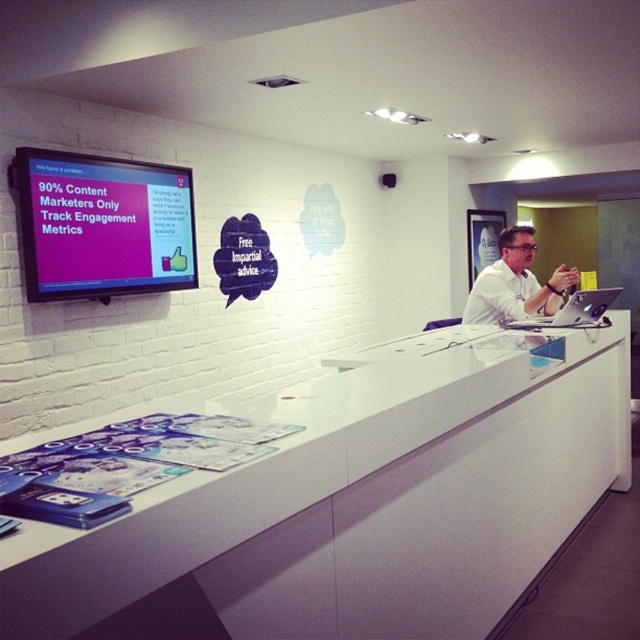
Question: From the image, what is the correct spatial relationship of white glossy counter at center in relation to white shirt at center?

Choices:
 (A) above
 (B) below

Answer: (B)

Question: Which of the following is the closest to the observer?

Choices:
 (A) 326,620
 (B) 509,259

Answer: (A)

Question: Does white glossy counter at center appear on the right side of white shirt at center?

Choices:
 (A) no
 (B) yes

Answer: (A)

Question: Can you confirm if white glossy counter at center is positioned below white shirt at center?

Choices:
 (A) no
 (B) yes

Answer: (B)

Question: Which point is closer to the camera?

Choices:
 (A) (493, 289)
 (B) (476, 356)

Answer: (B)